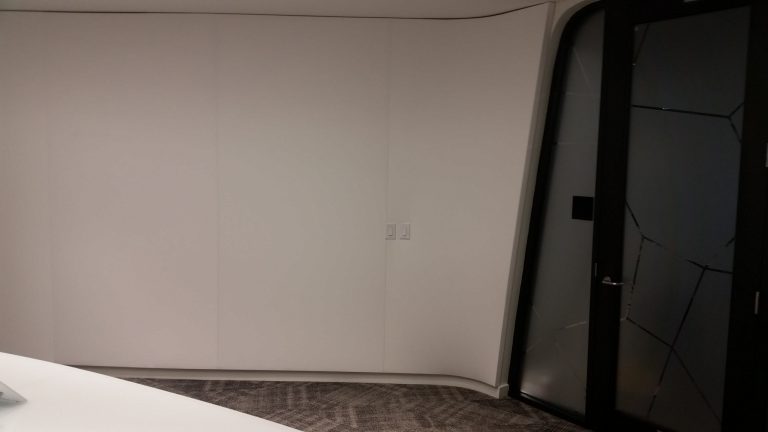
Where is `white table`? Image resolution: width=768 pixels, height=432 pixels. white table is located at coordinates (x=147, y=405).